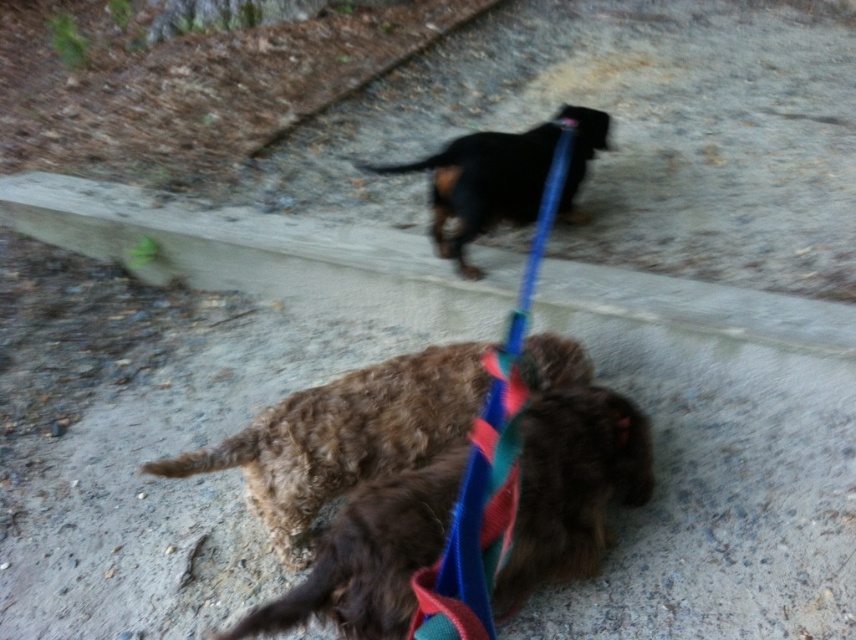
Based on the photo, you are a dog owner trying to identify your pets in a photo. You have two dogs, a brown curly fur dog at center and a curly brown fur at center. Which one is closer to the ground?

The brown curly fur dog at center is shorter than curly brown fur at center, so the brown curly fur dog at center is closer to the ground.

In the scene shown: You are a dog walker holding a leash. You see the brown curly fur dog at center and the black glossy dog at upper center. Which dog is wider?

The black glossy dog at upper center is wider than the brown curly fur dog at center.

You are a photographer trying to capture a photo of the two dogs. You notice the blue fabric leash at upper center in your viewfinder. Based on its position, can you estimate whether the leash is closer to the camera or further away compared to the dogs?

The blue fabric leash at upper center is located at point coordinates which indicate it is positioned further away from the camera than the dogs, so it is further away compared to the dogs.